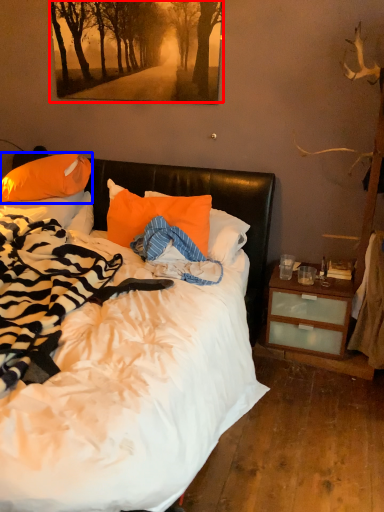
Question: Which object is further to the camera taking this photo, tree (highlighted by a red box) or pillow (highlighted by a blue box)?

Choices:
 (A) tree
 (B) pillow

Answer: (B)